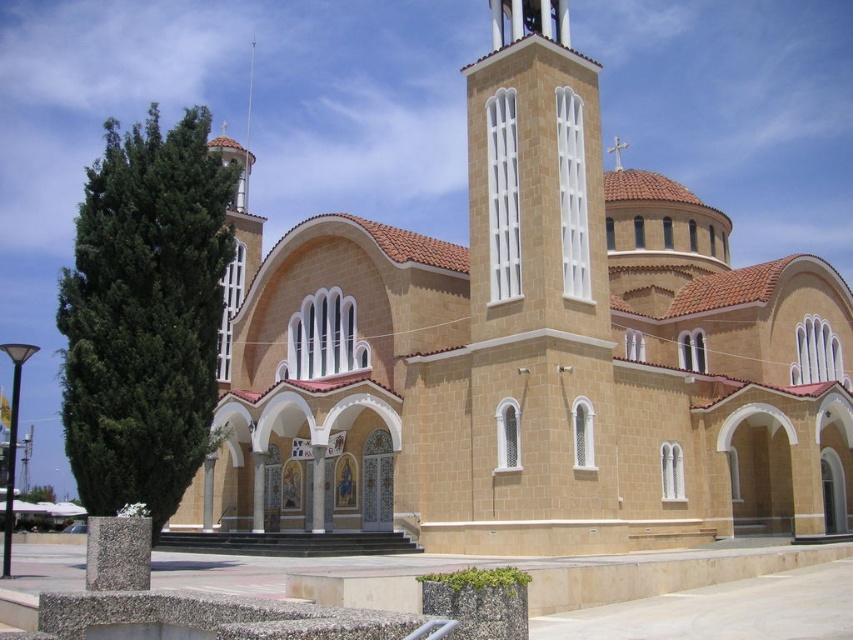
You are a photographer planning to capture the beige stone church at center and the smooth silver spire at upper center in a single shot. Based on their sizes, which one should you focus on to ensure both are visible without cropping?

The beige stone church at center is larger than the smooth silver spire at upper center, so focusing on the church will help ensure both are visible in the frame without cropping.

You are standing in front of the church and want to take a photo. There are two points marked on the facade, point 1 at coordinates point (329, 243) and point 2 at coordinates point (248, 108). Which point is closer to you?

Point (329, 243) is closer to the camera than point (248, 108), so point 1 is closer to you.